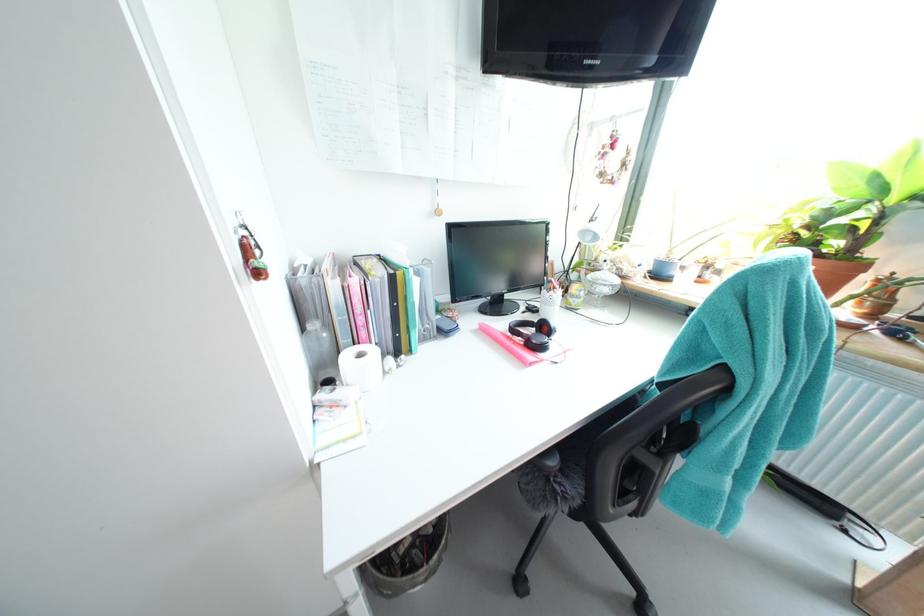
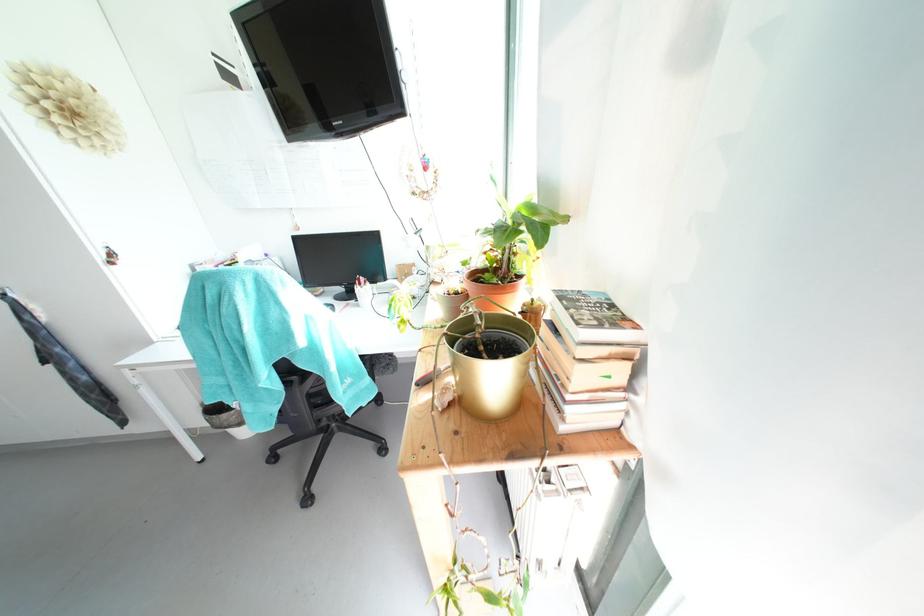
Question: The images are taken continuously from a first-person perspective. In which direction are you moving?

Choices:
 (A) Left
 (B) Right
 (C) Forward
 (D) Backward

Answer: (B)